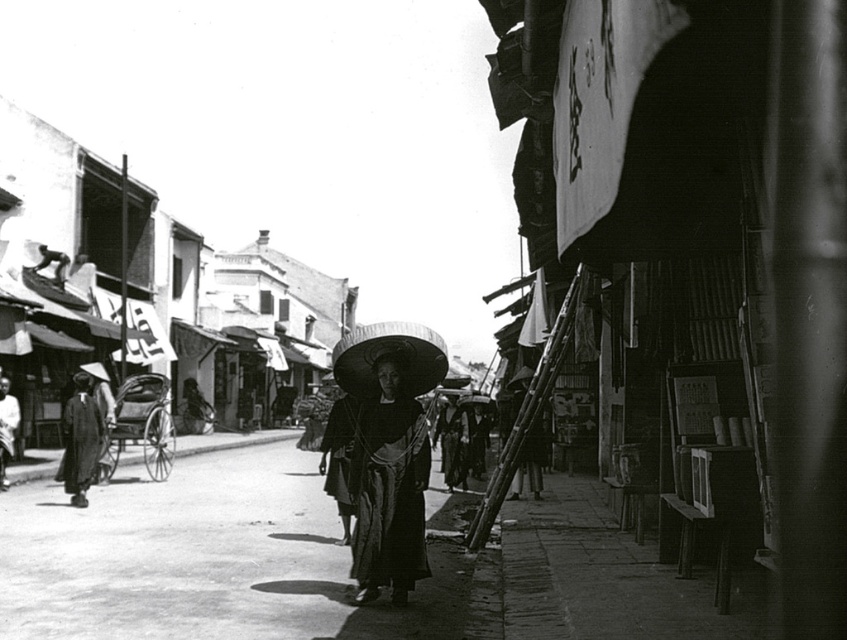
Question: Which object is the farthest from the smooth black coat at left?

Choices:
 (A) dark fabric kimono at center
 (B) matte black dress at center

Answer: (B)

Question: Does matte black dress at center appear under dark fabric kimono at center?

Choices:
 (A) no
 (B) yes

Answer: (A)

Question: Which of the following is the closest to the observer?

Choices:
 (A) smooth concrete pavement at center
 (B) dark fabric kimono at center

Answer: (A)

Question: Is smooth concrete pavement at center wider than smooth black coat at left?

Choices:
 (A) no
 (B) yes

Answer: (B)

Question: Estimate the real-world distances between objects in this image. Which object is farther from the matte black dress at center?

Choices:
 (A) smooth black coat at left
 (B) smooth concrete pavement at center
 (C) dark fabric kimono at center

Answer: (C)

Question: Is smooth concrete pavement at center wider than dark fabric kimono at center?

Choices:
 (A) yes
 (B) no

Answer: (A)